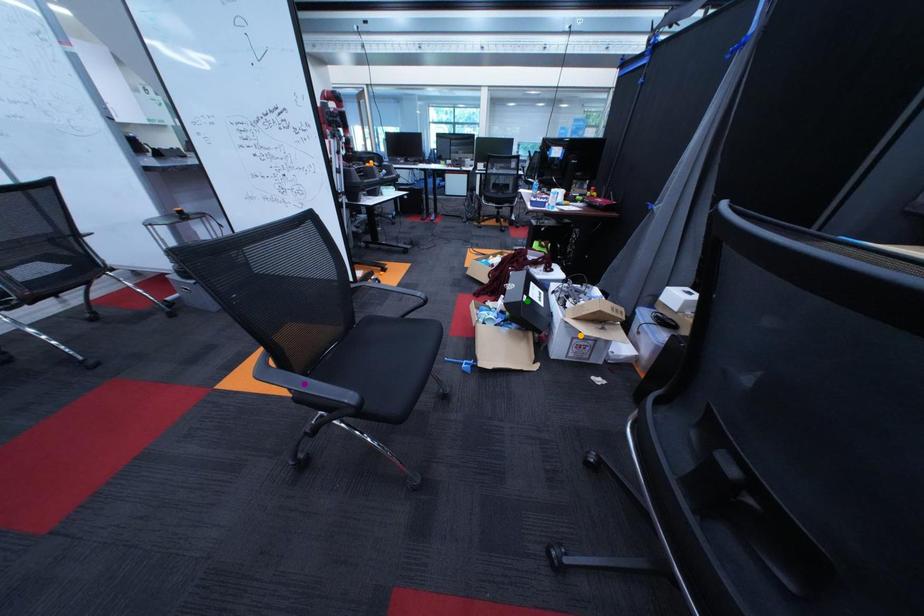
Based on the photo, order these from nearest to farthest:
green point | purple point | orange point

purple point → orange point → green point